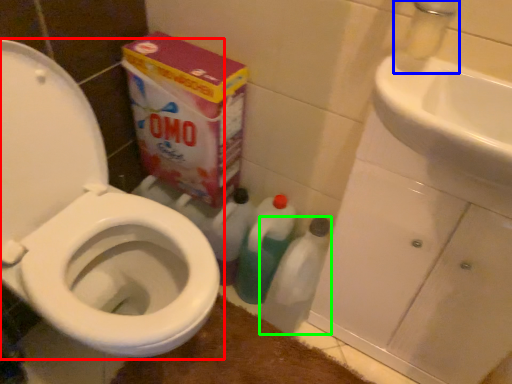
Question: Which object is the closest to the toilet (highlighted by a red box)? Choose among these: faucet (highlighted by a blue box) or cleaning product (highlighted by a green box).

Choices:
 (A) faucet
 (B) cleaning product

Answer: (B)